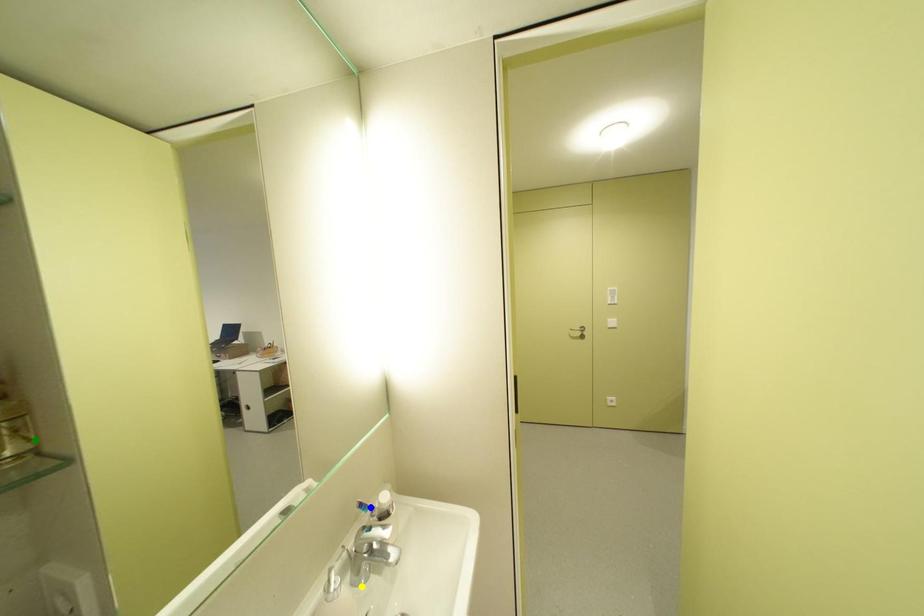
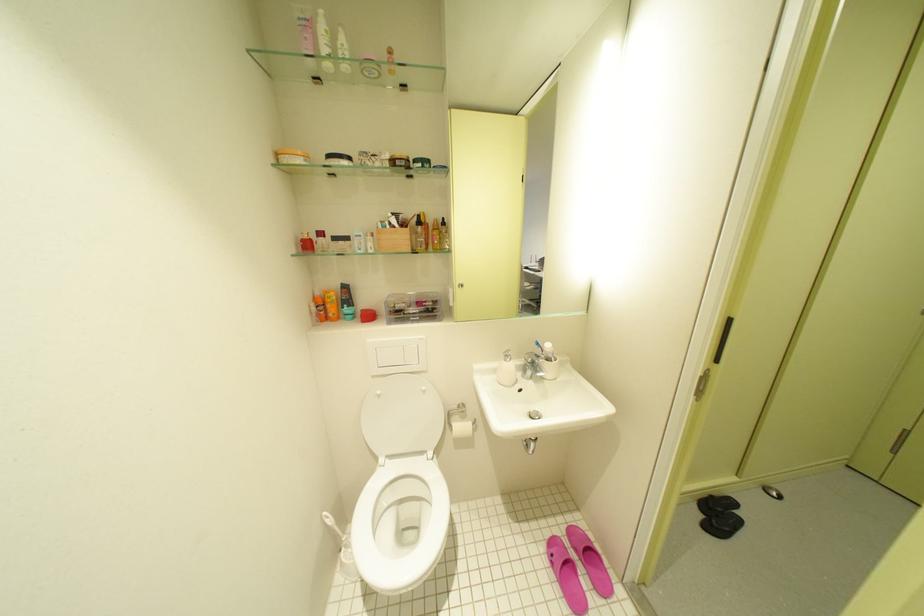
I am providing you with two images of the same scene from different viewpoints. Three points are marked in image1. Which point corresponds to a part or object that is occluded in image2?In image1, three points are marked. Which of them correspond to a part or object that is occluded in image2?Among the three points shown in image1, which one corresponds to a part or object that is no longer visible due to occlusion in image2?

Invisible in image2: green point.